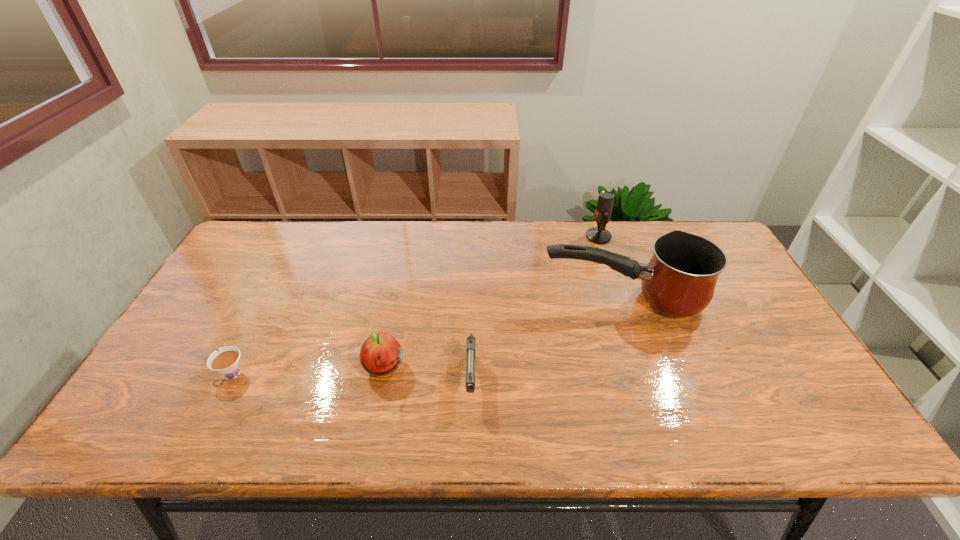
Identify the location of free point between the microphone and the third object from left to right. The height and width of the screenshot is (540, 960). (535, 308).

Find the location of `vacant point located between the fourth shortest object and the second object from left to right`. vacant point located between the fourth shortest object and the second object from left to right is located at coordinates (491, 302).

You are a GUI agent. You are given a task and a screenshot of the screen. Output one action in this format:
    pyautogui.click(x=<x>, y=<y>)
    Task: Click on the unoccupied area between the saucepan and the teacup
    This screenshot has height=540, width=960.
    Given the screenshot: What is the action you would take?
    (x=426, y=336)

At what (x,y) coordinates should I click in order to perform the action: click on the closest object relative to the third object from right to left. Please return your answer as a coordinate pair (x, y). Looking at the image, I should click on click(x=380, y=355).

Locate an element on the screen. The image size is (960, 540). the fourth closest object to the fourth object from right to left is located at coordinates point(599,235).

Identify the location of vacant region that satisfies the following two spatial constraints: 1. on the handle side of the second farthest object; 2. in the direction the third object from left to right is aimed. (649, 379).

Locate an element on the screen. The image size is (960, 540). free space that satisfies the following two spatial constraints: 1. on the handle side of the second farthest object; 2. in the direction the gun is aimed is located at coordinates (649, 379).

At what (x,y) coordinates should I click in order to perform the action: click on vacant point that satisfies the following two spatial constraints: 1. on the handle side of the fourth nearest object; 2. in the direction the gun is aimed. Please return your answer as a coordinate pair (x, y). This screenshot has width=960, height=540. Looking at the image, I should click on (649, 379).